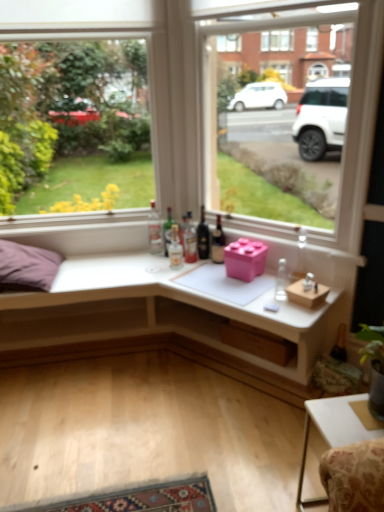
Identify the location of free spot in front of clear glass bottle at center, positioned as the 7th bottle in left-to-right order. (282, 312).